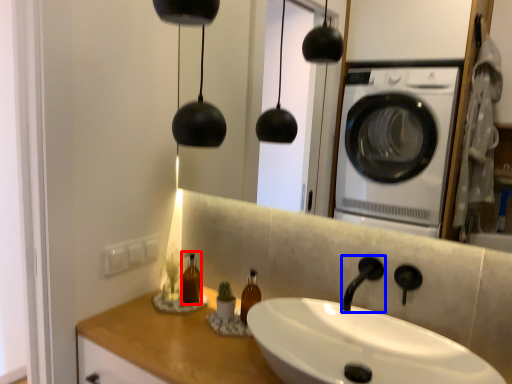
Question: Which of the following is the closest to the observer, bottle (highlighted by a red box) or faucet (highlighted by a blue box)?

Choices:
 (A) bottle
 (B) faucet

Answer: (B)